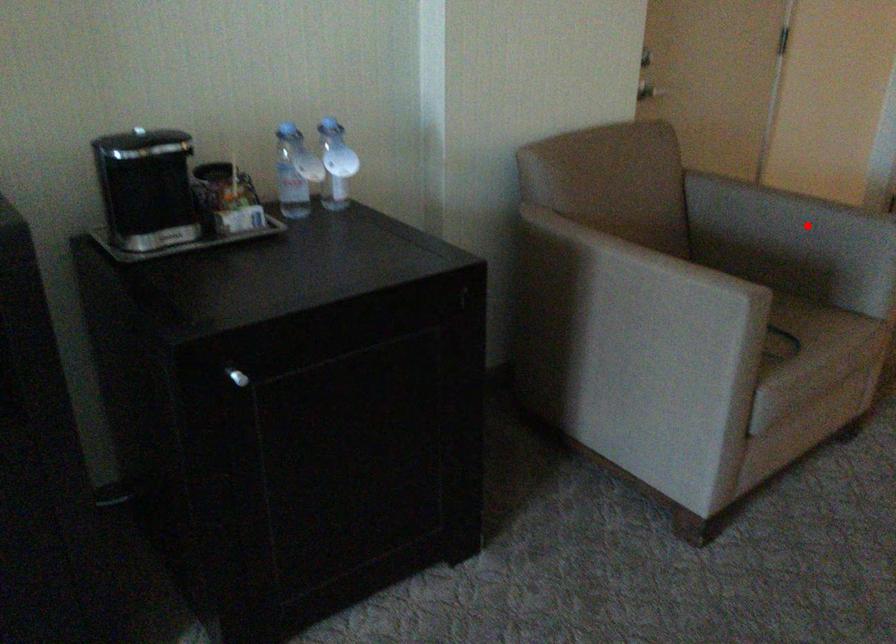
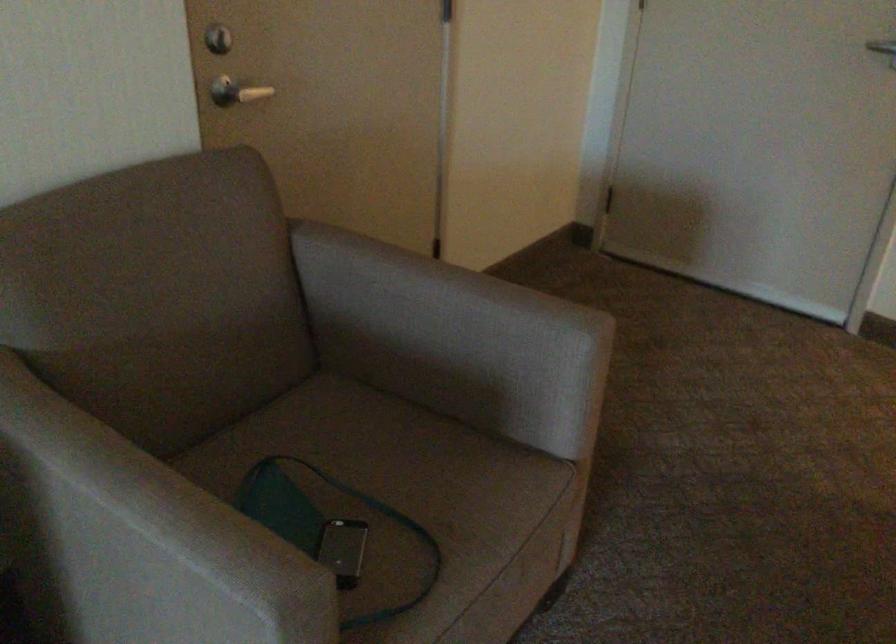
Where in the second image is the point corresponding to the highlighted location from the first image?

(453, 339)